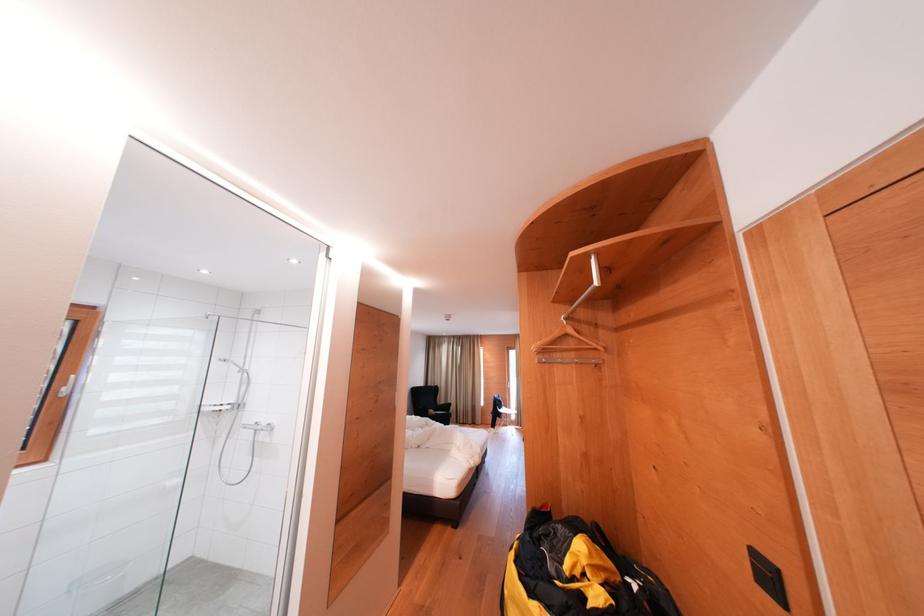
The width and height of the screenshot is (924, 616). Find the location of `metal clothes rod`. metal clothes rod is located at coordinates (572, 330).